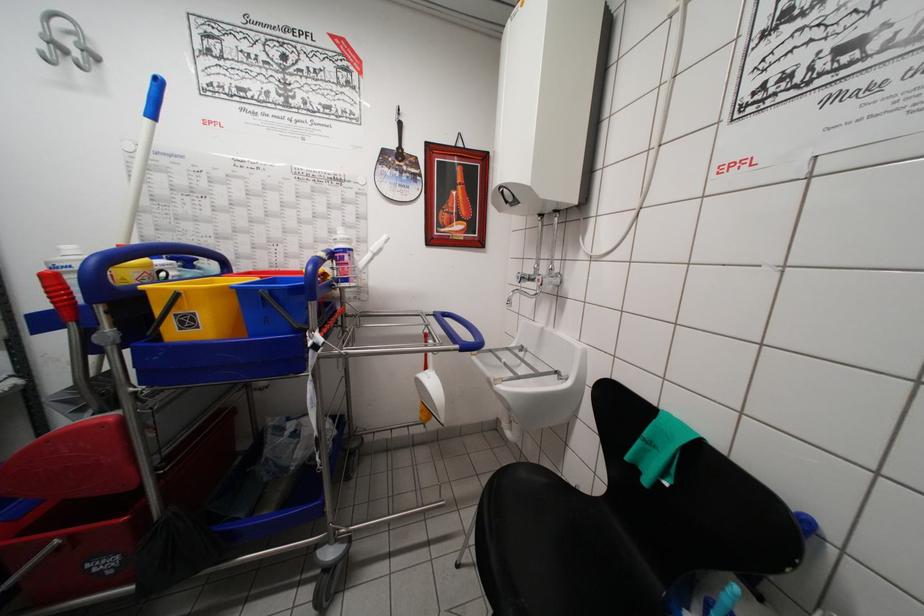
What do you see at coordinates (458, 331) in the screenshot? I see `the blue cart handle` at bounding box center [458, 331].